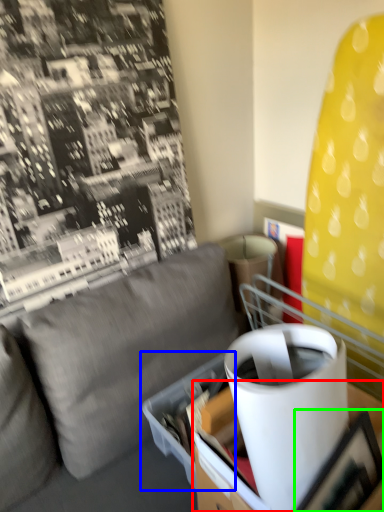
Question: Which object is the closest to the table (highlighted by a red box)? Choose among these: cardboard box (highlighted by a blue box) or picture frame (highlighted by a green box).

Choices:
 (A) cardboard box
 (B) picture frame

Answer: (A)